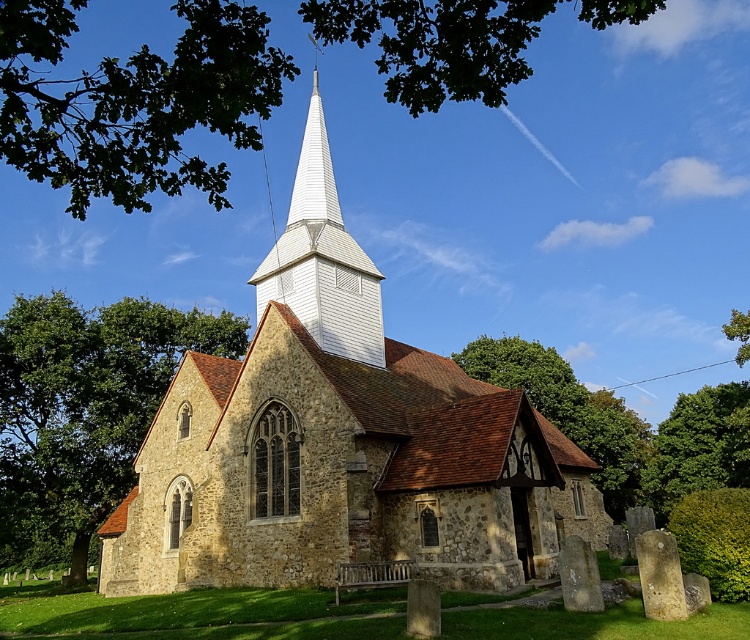
Which is more to the left, white wooden spire at center or green leafy tree at center?

white wooden spire at center

What do you see at coordinates (322, 259) in the screenshot? I see `white wooden spire at center` at bounding box center [322, 259].

This screenshot has height=640, width=750. Identify the location of white wooden spire at center. (322, 259).

Where is `white wooden spire at center`? Image resolution: width=750 pixels, height=640 pixels. white wooden spire at center is located at coordinates (322, 259).

Which is above, stone church at center or green leafy tree at center?

stone church at center is higher up.

Who is more forward, (x=310, y=257) or (x=615, y=444)?

Point (x=310, y=257)

Locate an element on the screen. The height and width of the screenshot is (640, 750). stone church at center is located at coordinates (340, 442).

Is green leafy tree at left to the right of green leafy tree at lower right from the viewer's perspective?

In fact, green leafy tree at left is to the left of green leafy tree at lower right.

Find the location of `green leafy tree at left`. green leafy tree at left is located at coordinates click(84, 410).

Locate an element on the screen. This screenshot has height=640, width=750. green leafy tree at left is located at coordinates (84, 410).